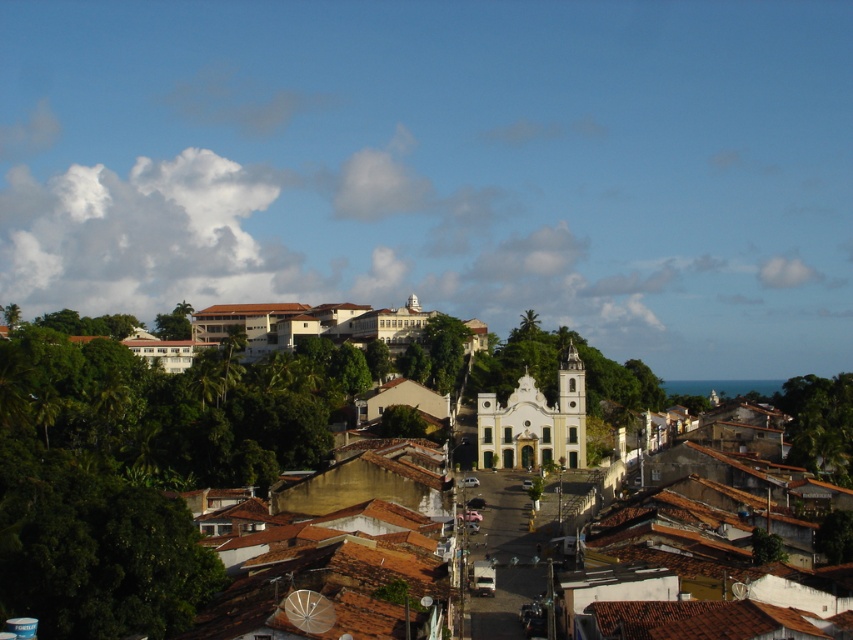
Question: Is white stucco church at center thinner than green leafy tree at lower right?

Choices:
 (A) yes
 (B) no

Answer: (B)

Question: Does green leafy tree at lower right lie behind green leafy tree at center?

Choices:
 (A) no
 (B) yes

Answer: (A)

Question: Which of the following is the farthest from the observer?

Choices:
 (A) (397, 410)
 (B) (0, 538)

Answer: (A)

Question: Which point appears closest to the camera in this image?

Choices:
 (A) (71, 387)
 (B) (399, 433)
 (C) (843, 400)

Answer: (B)

Question: Is white stucco church at center in front of green leafy tree at center?

Choices:
 (A) yes
 (B) no

Answer: (A)

Question: Among these objects, which one is farthest from the camera?

Choices:
 (A) green leafy tree at lower right
 (B) green leafy tree at center
 (C) white stucco church at center

Answer: (B)